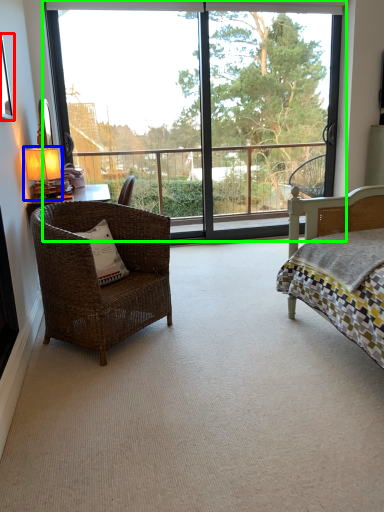
Question: Which object is the closest to the picture frame (highlighted by a red box)? Choose among these: table lamp (highlighted by a blue box) or window (highlighted by a green box).

Choices:
 (A) table lamp
 (B) window

Answer: (A)